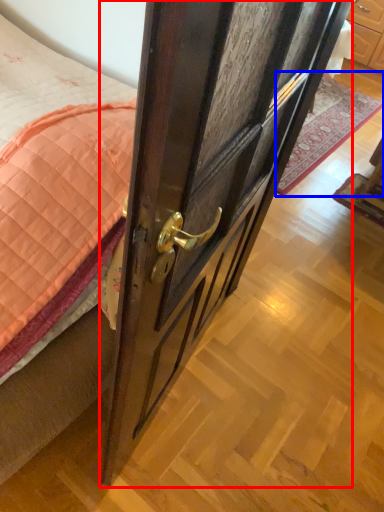
Question: Which object appears closest to the camera in this image, door (highlighted by a red box) or plain (highlighted by a blue box)?

Choices:
 (A) door
 (B) plain

Answer: (A)